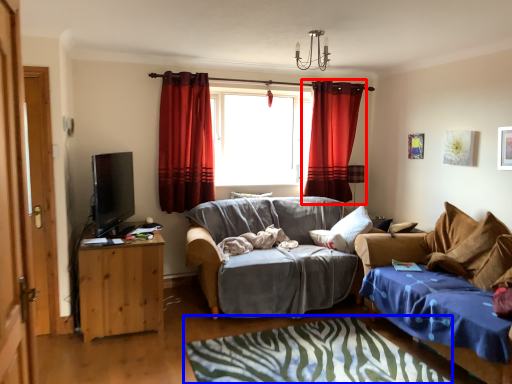
Question: Which object appears closest to the camera in this image, curtain (highlighted by a red box) or bedcover (highlighted by a blue box)?

Choices:
 (A) curtain
 (B) bedcover

Answer: (B)